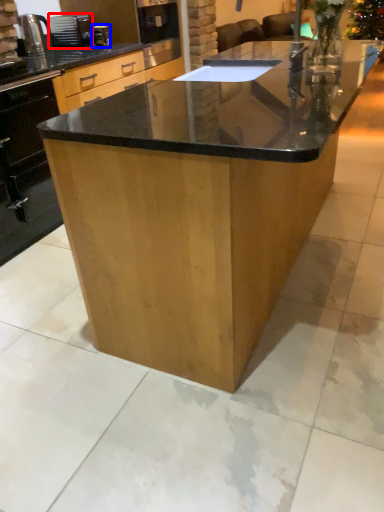
Question: Which of the following is the closest to the observer, appliance (highlighted by a red box) or coffee machine (highlighted by a blue box)?

Choices:
 (A) appliance
 (B) coffee machine

Answer: (B)